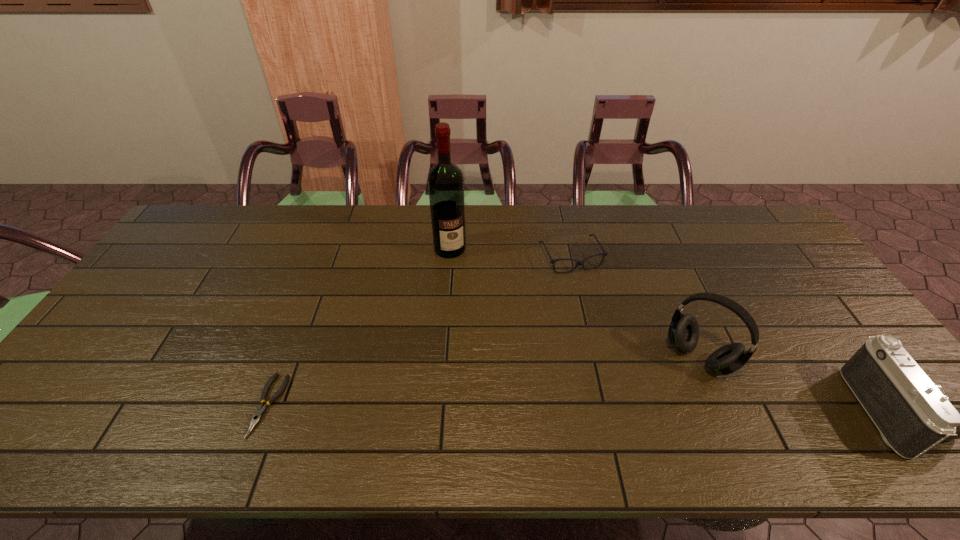
What are the coordinates of `headset present at the near edge` in the screenshot? It's located at (683, 334).

The image size is (960, 540). What are the coordinates of `vacant space at the far edge` in the screenshot? It's located at pyautogui.click(x=636, y=241).

The width and height of the screenshot is (960, 540). What are the coordinates of `free space at the near edge of the desktop` in the screenshot? It's located at (138, 400).

Locate an element on the screen. Image resolution: width=960 pixels, height=540 pixels. vacant area at the right edge is located at coordinates (748, 251).

What are the coordinates of `vacant area that lies between the alcohol and the second tallest object` in the screenshot? It's located at (574, 302).

In order to click on free space between the alcohol and the pliers in this screenshot , I will do `click(360, 327)`.

This screenshot has width=960, height=540. In order to click on free spot between the spectacles and the second object from right to left in this screenshot , I will do `click(635, 307)`.

Image resolution: width=960 pixels, height=540 pixels. Find the location of `object that is the second closest to the second shortest object`. object that is the second closest to the second shortest object is located at coordinates (683, 334).

Find the location of a particular element. The height and width of the screenshot is (540, 960). the fourth closest object to the second object from left to right is located at coordinates coord(911,411).

Where is `free location that satisfies the following two spatial constraints: 1. on the back side of the pliers; 2. on the right side of the third object from left to right`? This screenshot has width=960, height=540. free location that satisfies the following two spatial constraints: 1. on the back side of the pliers; 2. on the right side of the third object from left to right is located at coordinates (325, 257).